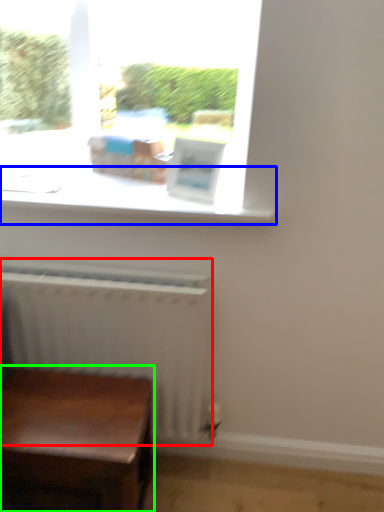
Question: Considering the real-world distances, which object is farthest from radiator (highlighted by a red box)? window sill (highlighted by a blue box) or table (highlighted by a green box)?

Choices:
 (A) window sill
 (B) table

Answer: (A)